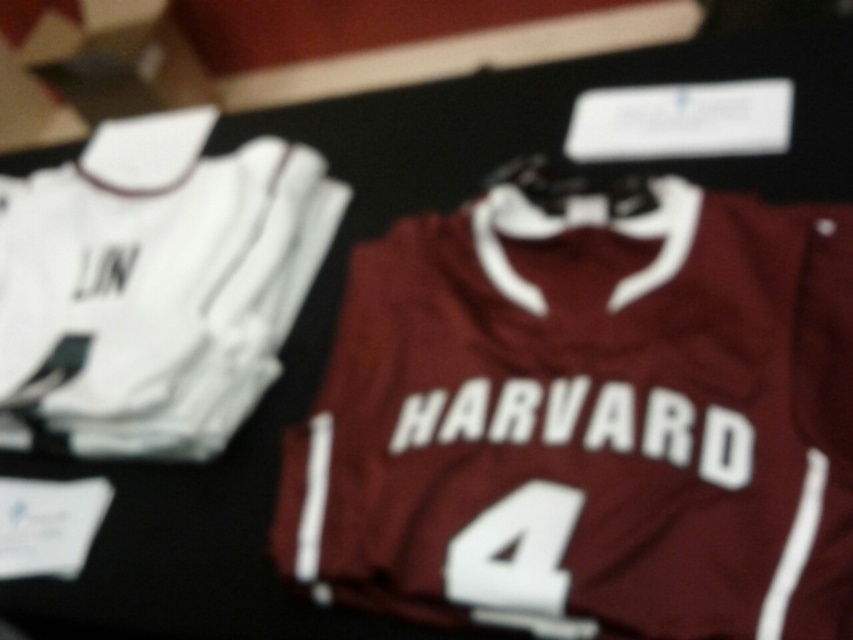
You are a sports memorabilia collector who wants to place a 10 inch wide decorative plaque between the maroon jersey at right and the white jersey at left on the display table. Based on the spacing between them, will the plaque fit without overlapping either jersey?

The maroon jersey at right and white jersey at left are 10.17 inches apart. Since the plaque is 10 inches wide, it will fit between them without overlapping as there is enough space.

You are an athlete trying to choose between the two jerseys displayed on the dark surface. You want to pick the one located at point (155, 284). Which jersey should you choose?

The white jersey at left is located at point (155, 284), so you should choose the white jersey at left.

You are organizing a sports memorabilia exhibit. You have a maroon jersey at right and a white fabric number at center. Which item takes up more space on the display table?

The maroon jersey at right is bigger than the white fabric number at center, so it takes up more space on the display table.